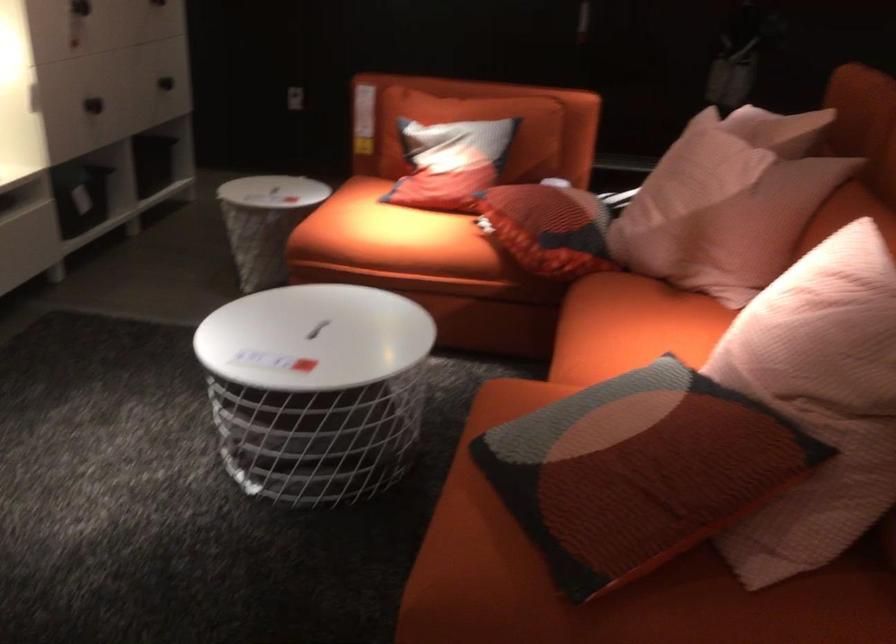
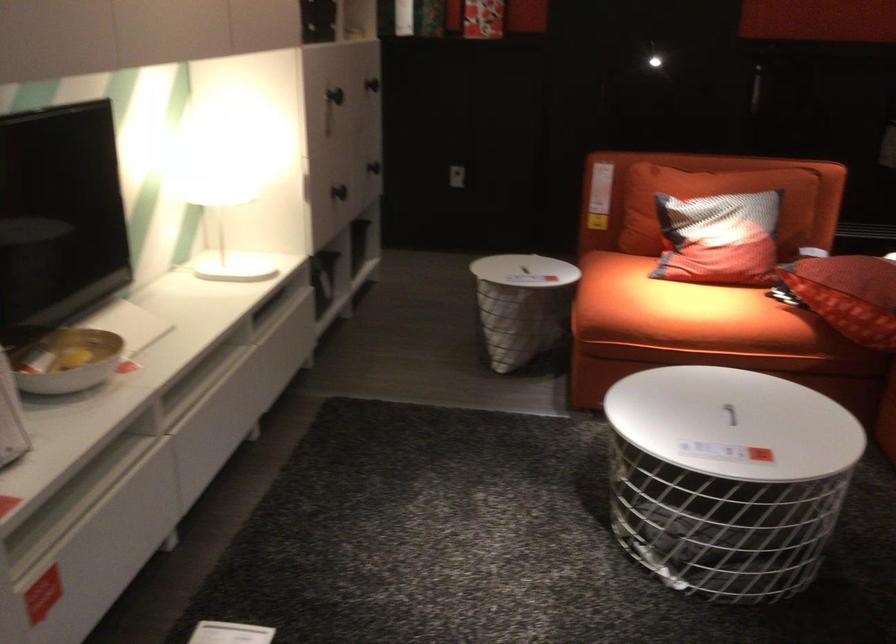
Where in the second image is the point corresponding to (x=382, y=236) from the first image?

(684, 312)